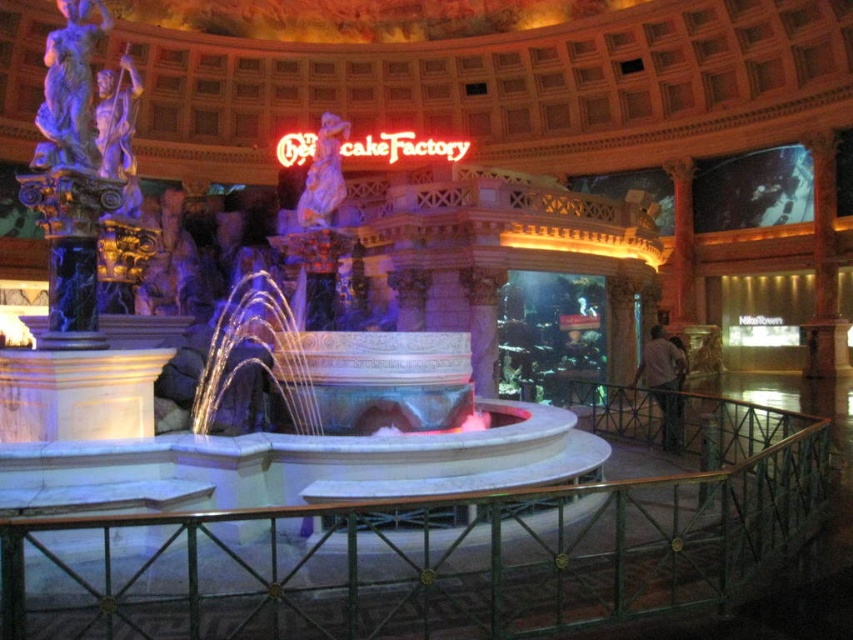
You are a guest at the hotel and want to take a photo of the neontexturedsign at center and the green metal railing at center. Which object should you focus on first if you want to capture both in one frame without moving the camera?

The green metal railing at center is shorter than the neontexturedsign at center, so you should focus on the neontexturedsign at center first to ensure it fits within the frame.